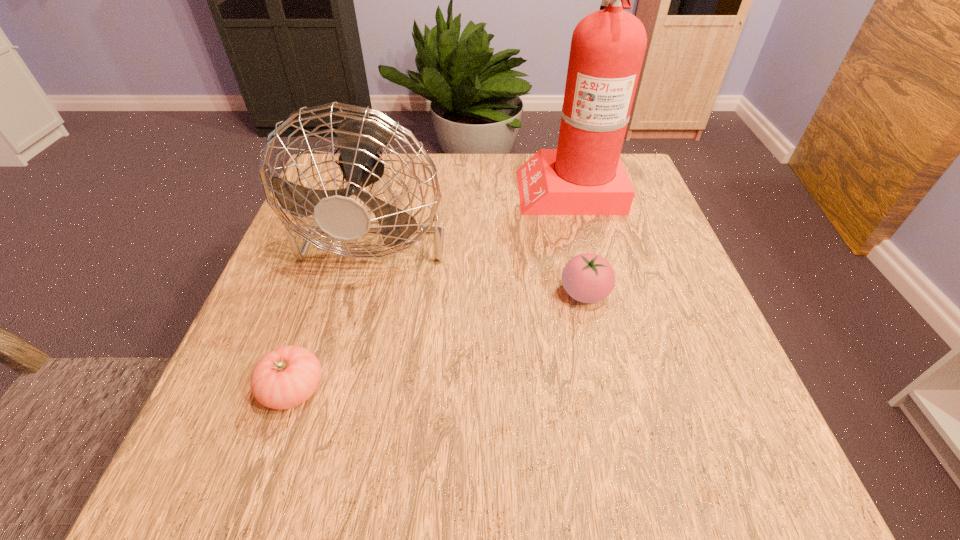
Locate an element on the screen. This screenshot has width=960, height=540. empty space that is in between the taller tomato and the tallest object is located at coordinates (576, 241).

Find the location of a particular element. The height and width of the screenshot is (540, 960). free area in between the second shortest object and the tallest object is located at coordinates (576, 241).

At what (x,y) coordinates should I click in order to perform the action: click on free spot between the fire extinguisher and the fan. Please return your answer as a coordinate pair (x, y). Looking at the image, I should click on (474, 207).

At what (x,y) coordinates should I click in order to perform the action: click on free space between the fan and the left tomato. Please return your answer as a coordinate pair (x, y). The width and height of the screenshot is (960, 540). Looking at the image, I should click on (337, 307).

You are a GUI agent. You are given a task and a screenshot of the screen. Output one action in this format:
    pyautogui.click(x=<x>, y=<y>)
    Task: Click on the free space between the taller tomato and the fan
    
    Given the screenshot: What is the action you would take?
    pyautogui.click(x=482, y=259)

Locate which object ranks second in proximity to the taller tomato. Please provide its 2D coordinates. Your answer should be formatted as a tuple, i.e. [(x, y)], where the tuple contains the x and y coordinates of a point satisfying the conditions above.

[(360, 137)]

The width and height of the screenshot is (960, 540). Find the location of `object that stands as the closest to the nearer tomato`. object that stands as the closest to the nearer tomato is located at coordinates click(x=360, y=137).

Locate an element on the screen. The height and width of the screenshot is (540, 960). vacant position in the image that satisfies the following two spatial constraints: 1. on the front-facing side of the tallest object; 2. on the front side of the nearer tomato is located at coordinates (618, 389).

Where is `vacant position in the image that satisfies the following two spatial constraints: 1. on the front-facing side of the tallest object; 2. on the front side of the third tallest object`? The width and height of the screenshot is (960, 540). vacant position in the image that satisfies the following two spatial constraints: 1. on the front-facing side of the tallest object; 2. on the front side of the third tallest object is located at coordinates (594, 293).